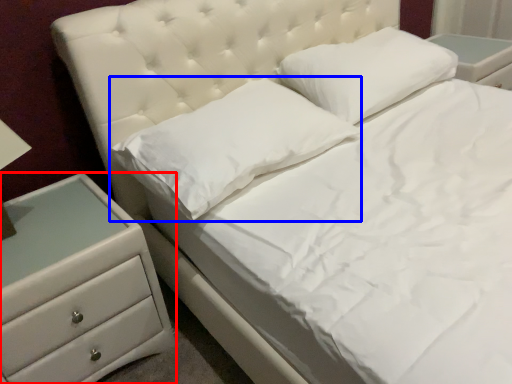
Question: Among these objects, which one is farthest to the camera, chest of drawers (highlighted by a red box) or pillow (highlighted by a blue box)?

Choices:
 (A) chest of drawers
 (B) pillow

Answer: (B)